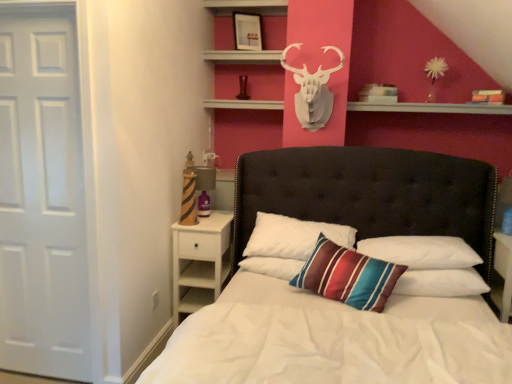
The height and width of the screenshot is (384, 512). Identify the location of white wood nightstand at lower left. (200, 261).

Image resolution: width=512 pixels, height=384 pixels. What do you see at coordinates (200, 261) in the screenshot? I see `white wood nightstand at lower left` at bounding box center [200, 261].

Describe the element at coordinates (44, 192) in the screenshot. I see `white matte door at left` at that location.

This screenshot has height=384, width=512. What do you see at coordinates (247, 31) in the screenshot?
I see `matte black picture frame at upper center` at bounding box center [247, 31].

Identify the location of white tufted headboard at center. The width and height of the screenshot is (512, 384). (368, 193).

Is the surface of white tufted headboard at center in direct contact with striped fabric pillow at center, marked as the 3th pillow in a left-to-right arrangement?

No, white tufted headboard at center is not in contact with striped fabric pillow at center, marked as the 3th pillow in a left-to-right arrangement.

Which object is closer to the camera taking this photo, white tufted headboard at center or striped fabric pillow at center, marked as the 1th pillow in a right-to-left arrangement?

white tufted headboard at center.

Which object is positioned more to the left, white tufted headboard at center or striped fabric pillow at center, marked as the 3th pillow in a left-to-right arrangement?

From the viewer's perspective, white tufted headboard at center appears more on the left side.

Can you confirm if white tufted headboard at center is bigger than striped fabric pillow at center, marked as the 1th pillow in a right-to-left arrangement?

Correct, white tufted headboard at center is larger in size than striped fabric pillow at center, marked as the 1th pillow in a right-to-left arrangement.

Locate an element on the screen. This screenshot has width=512, height=384. nightstand behind the striped fabric pillow at center, the 2th pillow from the left is located at coordinates (200, 261).

Considering the sizes of white wood nightstand at lower left and striped fabric pillow at center, marked as the second pillow in a right-to-left arrangement, in the image, is white wood nightstand at lower left taller or shorter than striped fabric pillow at center, marked as the second pillow in a right-to-left arrangement,?

In the image, white wood nightstand at lower left appears to be taller than striped fabric pillow at center, marked as the second pillow in a right-to-left arrangement.

Measure the distance from white wood nightstand at lower left to striped fabric pillow at center, the 2th pillow from the left.

white wood nightstand at lower left and striped fabric pillow at center, the 2th pillow from the left, are 82.09 centimeters apart from each other.

Is white wood nightstand at lower left not within striped fabric pillow at center, marked as the second pillow in a right-to-left arrangement?

Indeed, white wood nightstand at lower left is completely outside striped fabric pillow at center, marked as the second pillow in a right-to-left arrangement.

Can you see white matte door at left touching white matte/decorative deer head at upper center?

No, white matte door at left is not beside white matte/decorative deer head at upper center.

Which object is closer to the camera, white matte door at left or white matte/decorative deer head at upper center?

white matte door at left is in front.

How different are the orientations of white matte door at left and white matte/decorative deer head at upper center in degrees?

0.793 degrees separate the facing orientations of white matte door at left and white matte/decorative deer head at upper center.

Is point (210, 234) closer or farther from the camera than point (239, 31)?

Clearly, point (210, 234) is closer to the camera than point (239, 31).

Who is bigger, white wood nightstand at lower left or matte black picture frame at upper center?

white wood nightstand at lower left is bigger.

Is the surface of white wood nightstand at lower left in direct contact with matte black picture frame at upper center?

No, white wood nightstand at lower left is not touching matte black picture frame at upper center.

Looking at this image, what's the angular difference between white wood nightstand at lower left and matte black picture frame at upper center's facing directions?

30.2 degrees separate the facing orientations of white wood nightstand at lower left and matte black picture frame at upper center.

Does striped fabric pillow at center, marked as the second pillow in a right-to-left arrangement, have a greater width compared to white matte/decorative deer head at upper center?

In fact, striped fabric pillow at center, marked as the second pillow in a right-to-left arrangement, might be narrower than white matte/decorative deer head at upper center.

Is striped fabric pillow at center, the 2th pillow from the left, placed right next to white matte/decorative deer head at upper center?

No, striped fabric pillow at center, the 2th pillow from the left, is not making contact with white matte/decorative deer head at upper center.

Is point (384, 301) positioned behind point (302, 113)?

No, it is in front of (302, 113).

Which object is further away from the camera taking this photo, white wood nightstand at lower left or white tufted headboard at center?

white wood nightstand at lower left is behind.

Is white wood nightstand at lower left situated inside white tufted headboard at center or outside?

white wood nightstand at lower left lies within the bounds of white tufted headboard at center.

From the image's perspective, is white wood nightstand at lower left under white tufted headboard at center?

Indeed, from the image's perspective, white wood nightstand at lower left is shown beneath white tufted headboard at center.

From a real-world perspective, is white wood nightstand at lower left positioned above or below white tufted headboard at center?

From a real-world perspective, white wood nightstand at lower left is physically below white tufted headboard at center.

From the image's perspective, between white matte/decorative deer head at upper center and white soft pillow at center, placed as the third pillow when sorted from right to left, which one is located above?

white matte/decorative deer head at upper center, from the image's perspective.

Who is smaller, white matte/decorative deer head at upper center or white soft pillow at center, which is counted as the first pillow, starting from the left?

With smaller size is white soft pillow at center, which is counted as the first pillow, starting from the left.

From a real-world perspective, between white matte/decorative deer head at upper center and white soft pillow at center, which is counted as the first pillow, starting from the left, who is vertically higher?

In real-world perspective, white matte/decorative deer head at upper center is above.

Measure the distance between white matte/decorative deer head at upper center and white soft pillow at center, which is counted as the first pillow, starting from the left.

1.11 meters.

From the image's perspective, count 3rd pillows upward from the white tufted headboard at center and point to it. Please provide its 2D coordinates.

[(421, 251)]

I want to click on nightstand that is under the striped fabric pillow at center, marked as the second pillow in a right-to-left arrangement (from a real-world perspective), so click(x=200, y=261).

Based on their spatial positions, is white tufted headboard at center or white wood nightstand at lower left further from white soft pillow at center, which is counted as the first pillow, starting from the left?

white tufted headboard at center.

Which object lies further to the anchor point striped fabric pillow at center, the 2th pillow from the left, matte black picture frame at upper center or striped fabric pillow at center, marked as the 1th pillow in a right-to-left arrangement?

The object further to striped fabric pillow at center, the 2th pillow from the left, is matte black picture frame at upper center.

Considering their positions, is white tufted headboard at center positioned further to white matte door at left than white soft pillow at center, which is counted as the first pillow, starting from the left?

white tufted headboard at center is further to white matte door at left.

Estimate the real-world distances between objects in this image. Which object is closer to matte black picture frame at upper center, striped fabric pillow at center, marked as the 3th pillow in a left-to-right arrangement, or white soft pillow at center, placed as the third pillow when sorted from right to left?

white soft pillow at center, placed as the third pillow when sorted from right to left.

Looking at the image, which one is located further to white tufted headboard at center, white wood nightstand at lower left or white soft pillow at center, placed as the third pillow when sorted from right to left?

Based on the image, white soft pillow at center, placed as the third pillow when sorted from right to left, appears to be further to white tufted headboard at center.

Considering their positions, is white wood nightstand at lower left positioned closer to white soft pillow at center, which is counted as the first pillow, starting from the left, than matte black picture frame at upper center?

white wood nightstand at lower left is positioned closer to the anchor white soft pillow at center, which is counted as the first pillow, starting from the left.

In the scene shown: Looking at the image, which one is located closer to white tufted headboard at center, white matte door at left or striped fabric pillow at center, the 2th pillow from the left?

Among the two, striped fabric pillow at center, the 2th pillow from the left, is located nearer to white tufted headboard at center.

Based on their spatial positions, is white soft pillow at center, placed as the third pillow when sorted from right to left, or white matte door at left further from striped fabric pillow at center, marked as the second pillow in a right-to-left arrangement?

white matte door at left is positioned further to the anchor striped fabric pillow at center, marked as the second pillow in a right-to-left arrangement.

The width and height of the screenshot is (512, 384). What are the coordinates of `door between matte black picture frame at upper center and striped fabric pillow at center, marked as the second pillow in a right-to-left arrangement, from top to bottom` in the screenshot? It's located at 44,192.

Find the location of a particular element. The image size is (512, 384). door between white tufted headboard at center and white soft pillow at center, which is counted as the first pillow, starting from the left, along the z-axis is located at coordinates (44, 192).

I want to click on pillow between white matte/decorative deer head at upper center and striped fabric pillow at center, marked as the second pillow in a right-to-left arrangement, from top to bottom, so click(x=421, y=251).

Where is `nightstand located between white matte door at left and striped fabric pillow at center, marked as the 1th pillow in a right-to-left arrangement, in the left-right direction`? Image resolution: width=512 pixels, height=384 pixels. nightstand located between white matte door at left and striped fabric pillow at center, marked as the 1th pillow in a right-to-left arrangement, in the left-right direction is located at coordinates (200, 261).